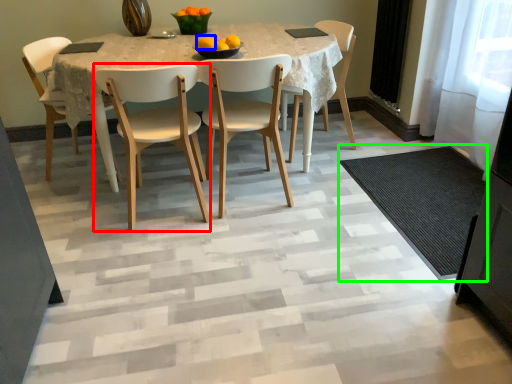
Question: Which object is positioned closest to chair (highlighted by a red box)? Select from orange (highlighted by a blue box) and doormat (highlighted by a green box).

Choices:
 (A) orange
 (B) doormat

Answer: (A)